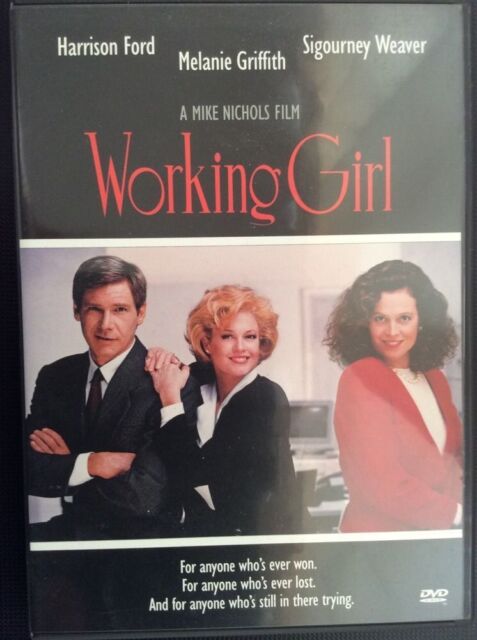
At what (x,y) coordinates should I click in order to perform the action: click on monitor. Please return your answer as a coordinate pair (x, y). The height and width of the screenshot is (640, 477). Looking at the image, I should click on [x=316, y=420].